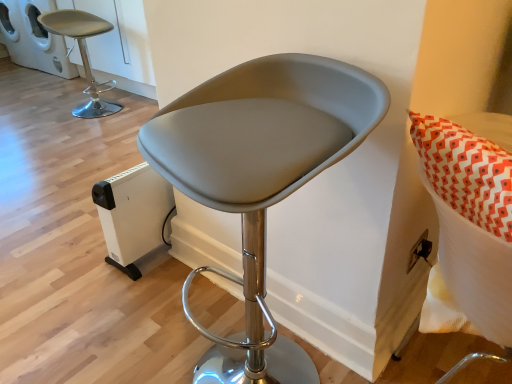
The image size is (512, 384). Identify the location of vacant region to the left of white plastic heater at lower left, which is the 2th appliance from left to right. (80, 264).